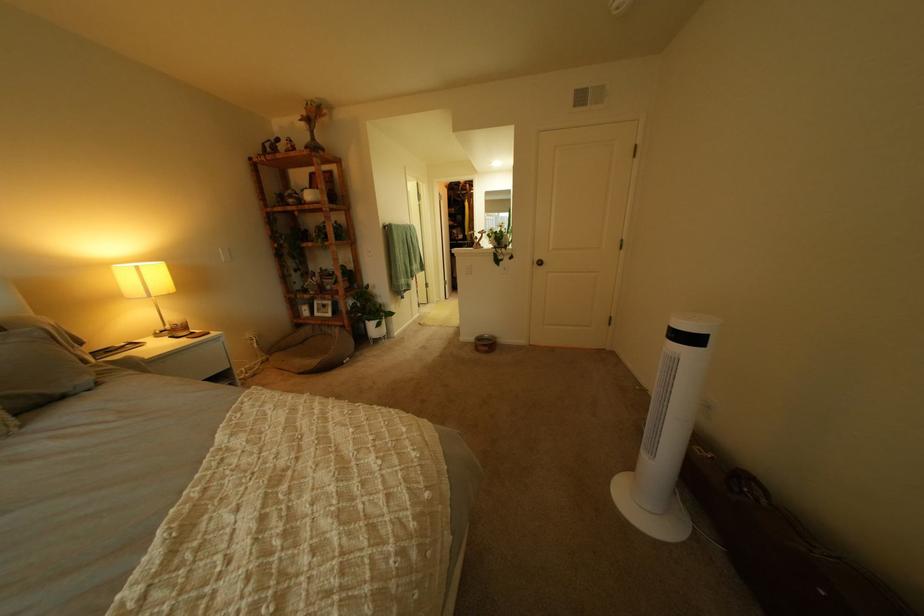
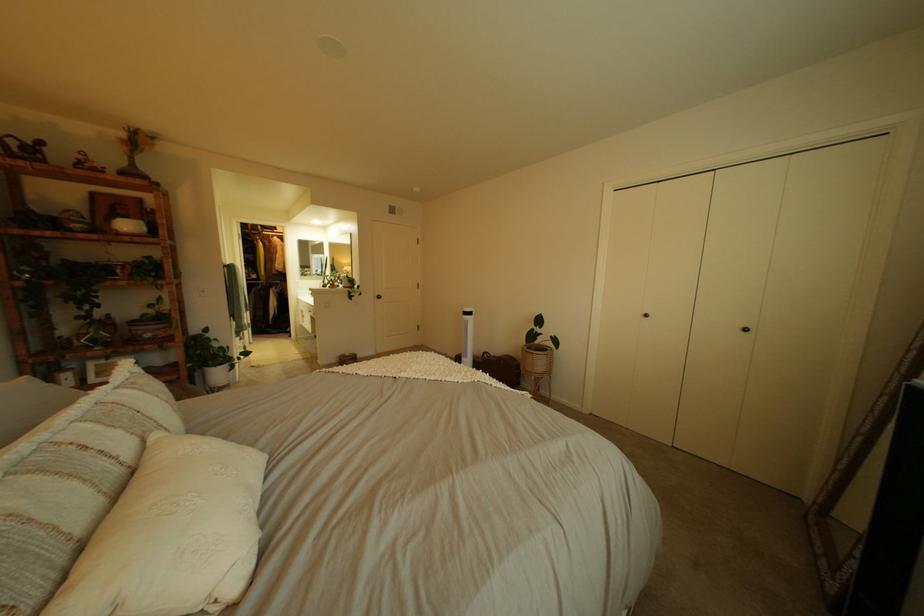
Locate, in the second image, the point that corresponds to pixel 321 201 in the first image.

(132, 232)